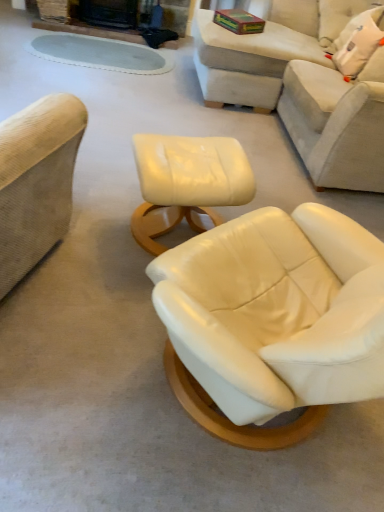
Question: Is matte cream ottoman at center a part of beige leather couch at upper right?

Choices:
 (A) yes
 (B) no

Answer: (B)

Question: Is beige leather couch at upper right taller than matte cream ottoman at center?

Choices:
 (A) yes
 (B) no

Answer: (A)

Question: From the image's perspective, is beige leather couch at upper right on top of matte cream ottoman at center?

Choices:
 (A) yes
 (B) no

Answer: (A)

Question: From the image's perspective, is beige leather couch at upper right beneath matte cream ottoman at center?

Choices:
 (A) no
 (B) yes

Answer: (A)

Question: Is beige leather couch at upper right aimed at matte cream ottoman at center?

Choices:
 (A) no
 (B) yes

Answer: (A)

Question: Considering the relative sizes of beige leather couch at upper right and matte cream ottoman at center in the image provided, is beige leather couch at upper right bigger than matte cream ottoman at center?

Choices:
 (A) no
 (B) yes

Answer: (B)

Question: Is matte cream ottoman at center completely or partially inside beige leather couch at upper right?

Choices:
 (A) yes
 (B) no

Answer: (B)

Question: Does beige leather couch at upper right have a larger size compared to matte cream ottoman at center?

Choices:
 (A) yes
 (B) no

Answer: (A)

Question: Is beige leather couch at upper right behind matte cream ottoman at center?

Choices:
 (A) no
 (B) yes

Answer: (B)

Question: Is matte cream ottoman at center at the back of beige leather couch at upper right?

Choices:
 (A) yes
 (B) no

Answer: (B)

Question: Considering the relative sizes of beige leather couch at upper right and matte cream ottoman at center in the image provided, is beige leather couch at upper right thinner than matte cream ottoman at center?

Choices:
 (A) yes
 (B) no

Answer: (B)

Question: Does beige leather couch at upper right have a greater height compared to matte cream ottoman at center?

Choices:
 (A) no
 (B) yes

Answer: (B)

Question: Is matte cream ottoman at center in contact with white fabric pillow at upper right?

Choices:
 (A) no
 (B) yes

Answer: (A)